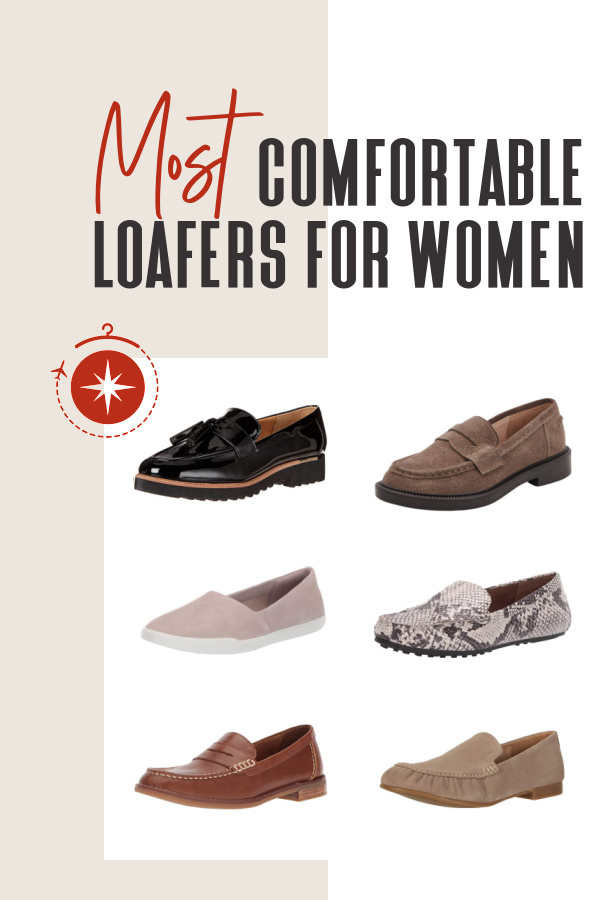
Locate an element on the screen. This screenshot has height=900, width=600. shoe is located at coordinates (239, 461), (222, 619), (288, 753), (470, 768), (459, 615), (469, 472).